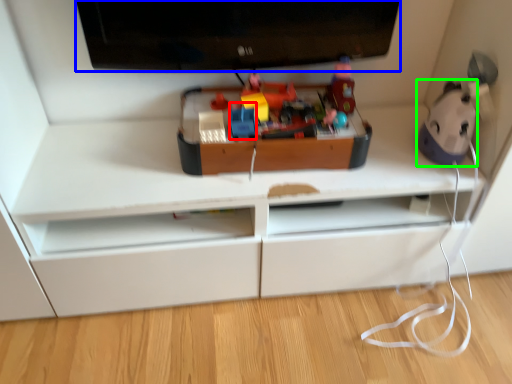
Question: Which is nearer to the toy (highlighted by a red box)? television (highlighted by a blue box) or toy (highlighted by a green box).

Choices:
 (A) television
 (B) toy

Answer: (A)